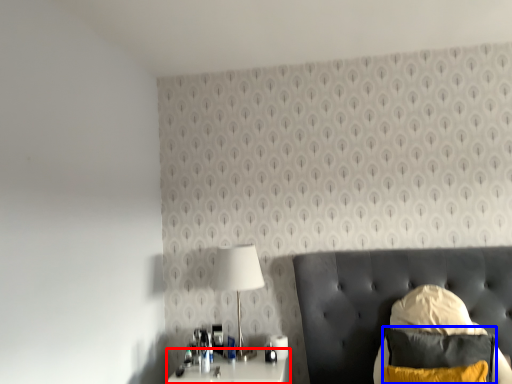
Question: Which object appears farthest to the camera in this image, nightstand (highlighted by a red box) or pillow (highlighted by a blue box)?

Choices:
 (A) nightstand
 (B) pillow

Answer: (A)